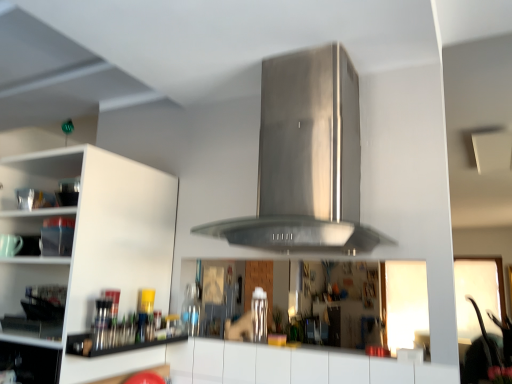
Question: Is stainless steel vent at center situated inside white matte cabinet at left or outside?

Choices:
 (A) outside
 (B) inside

Answer: (A)

Question: From the image's perspective, is stainless steel vent at center above or below white matte cabinet at left?

Choices:
 (A) above
 (B) below

Answer: (A)

Question: Estimate the real-world distances between objects in this image. Which object is closer to the white matte cabinet at left?

Choices:
 (A) metallic silver utensils at lower left
 (B) stainless steel vent at center

Answer: (A)

Question: Which object is positioned closest to the metallic silver utensils at lower left?

Choices:
 (A) white matte cabinet at left
 (B) stainless steel vent at center

Answer: (A)